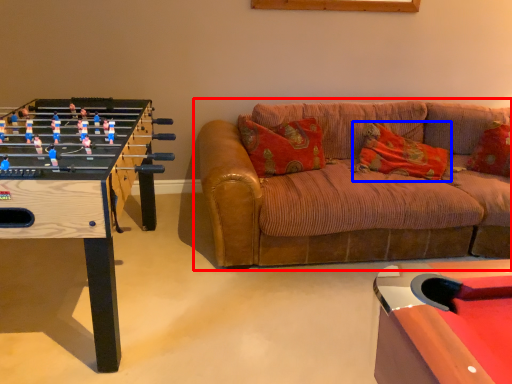
Question: Which object is closer to the camera taking this photo, studio couch (highlighted by a red box) or pillow (highlighted by a blue box)?

Choices:
 (A) studio couch
 (B) pillow

Answer: (A)